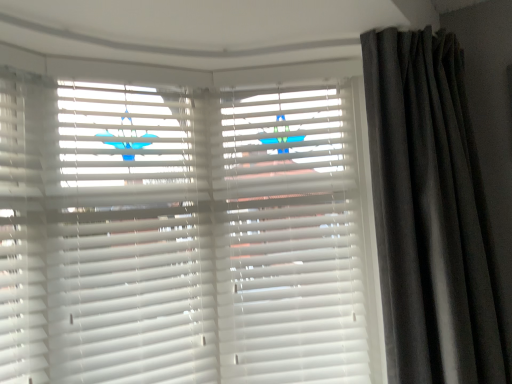
Question: Choose the correct answer: Is white matte blinds at center, placed as the 2th shutter when sorted from right to left, inside dark grey velvet curtain at right or outside it?

Choices:
 (A) inside
 (B) outside

Answer: (B)

Question: Considering their positions, is white matte blinds at center, placed as the 2th shutter when sorted from right to left, located in front of or behind dark grey velvet curtain at right?

Choices:
 (A) front
 (B) behind

Answer: (B)

Question: Considering the real-world distances, which object is farthest from the dark grey velvet curtain at right?

Choices:
 (A) white matte blinds at center, placed as the 2th shutter when sorted from right to left
 (B) white matte shutter at center, positioned as the second shutter in left-to-right order

Answer: (A)

Question: Which object is positioned closest to the dark grey velvet curtain at right?

Choices:
 (A) white matte shutter at center, the first shutter when ordered from right to left
 (B) white matte blinds at center, the first shutter positioned from the left

Answer: (A)